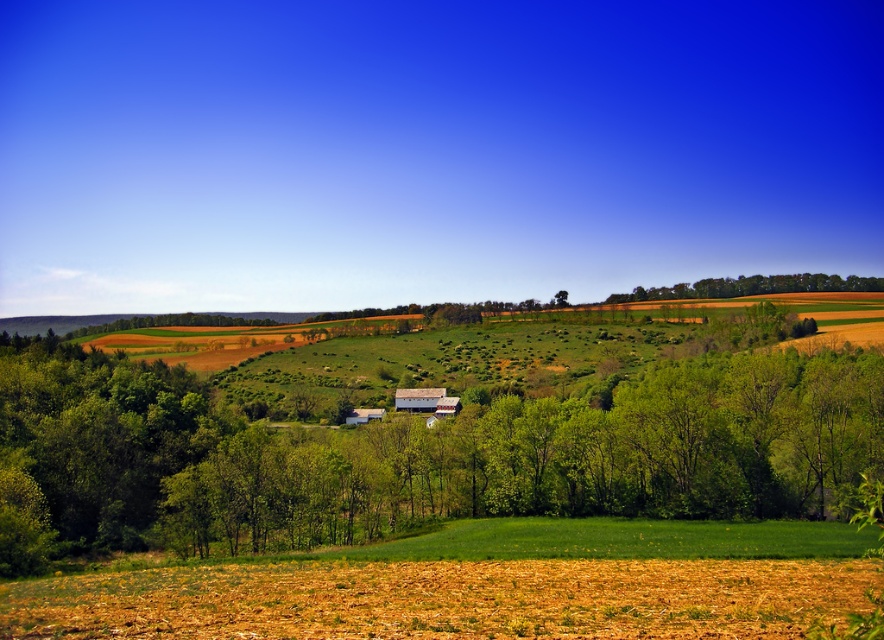
You are standing in the middle of the fields and see the green leafy tree at center and the green leafy trees at upper center. Which group of trees is closer to you?

The green leafy tree at center is closer to you because it is positioned under the green leafy trees at upper center, meaning it is in front of them.

You are standing at the center of the image and want to locate the green leafy tree at center. According to the coordinates provided, in which direction should you look to find it?

The green leafy tree at center is located at coordinates point (432,436). Since the center of the image is at point (442,320), you should look slightly to the right and upward to find it.